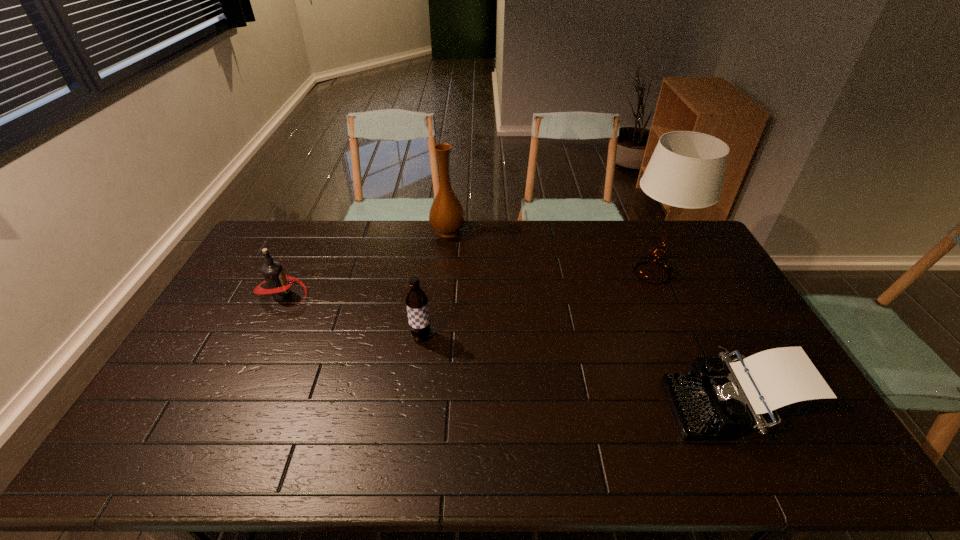
Locate an element on the screen. free spot at the near right corner of the desktop is located at coordinates [827, 438].

Where is `empty location between the vase and the tallest object`? empty location between the vase and the tallest object is located at coordinates (550, 252).

I want to click on blank region between the table lamp and the farther root beer, so click(468, 284).

Find the location of `free spot between the second tallest object and the nearest object`. free spot between the second tallest object and the nearest object is located at coordinates (588, 319).

Find the location of a particular element. The height and width of the screenshot is (540, 960). vacant point located between the farthest object and the shortest object is located at coordinates (588, 319).

I want to click on free point between the third shortest object and the farthest object, so click(x=435, y=284).

Find the location of a particular element. This screenshot has width=960, height=540. free space between the shortest object and the second nearest object is located at coordinates (575, 371).

The height and width of the screenshot is (540, 960). In order to click on blank region between the leftmost object and the second tallest object in this screenshot , I will do `click(366, 263)`.

Image resolution: width=960 pixels, height=540 pixels. In order to click on free spot between the second nearest object and the typewriter in this screenshot , I will do `click(575, 371)`.

Locate an element on the screen. unoccupied area between the table lamp and the fourth farthest object is located at coordinates (537, 305).